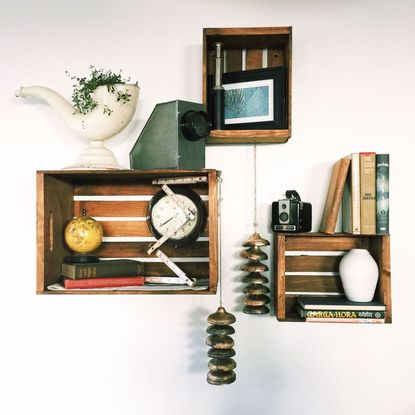
You are a GUI agent. You are given a task and a screenshot of the screen. Output one action in this format:
    pyautogui.click(x=<x>, y=<y>)
    Task: Click on the plant
    This screenshot has width=415, height=415.
    Given the screenshot: What is the action you would take?
    pyautogui.click(x=102, y=75)